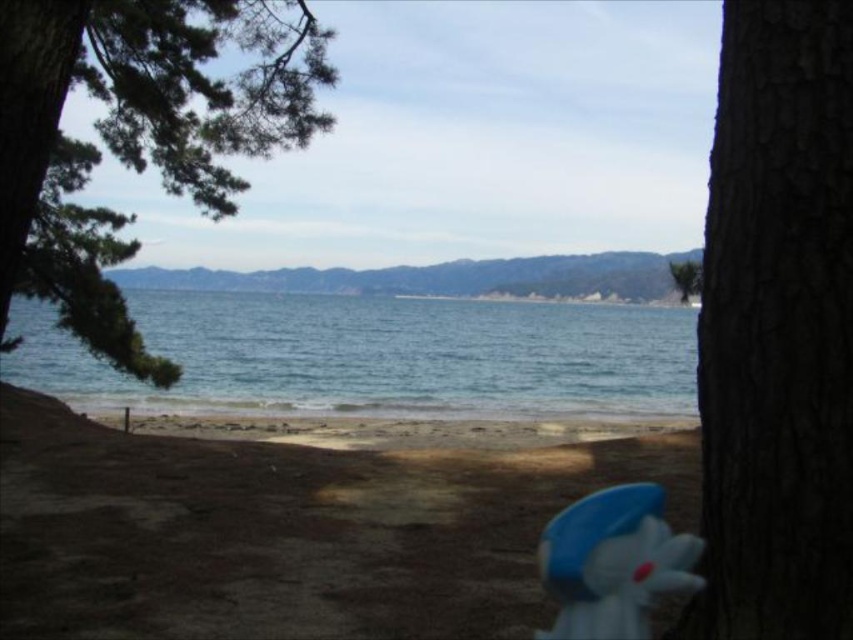
Is sandy brown beach at center positioned before blue water at center?

Yes, it is.

Is point (251, 593) more distant than point (277, 346)?

No, it is not.

Is point (78, 612) positioned behind point (132, 298)?

No, (78, 612) is in front of (132, 298).

In order to click on sandy brown beach at center in this screenshot , I will do `click(286, 531)`.

Is point (711, 397) positioned in front of point (662, 566)?

Yes.

Where is `brown rough bark tree at right`? This screenshot has width=853, height=640. brown rough bark tree at right is located at coordinates (776, 330).

At what (x,y) coordinates should I click in order to perform the action: click on brown rough bark tree at right. Please return your answer as a coordinate pair (x, y). Image resolution: width=853 pixels, height=640 pixels. Looking at the image, I should click on (776, 330).

Consider the image. Between sandy brown beach at center and blue rubber duck at lower right, which one has more height?

Standing taller between the two is blue rubber duck at lower right.

Between point (192, 634) and point (573, 576), which one is positioned in front?

Positioned in front is point (573, 576).

Find the location of a particular element. sandy brown beach at center is located at coordinates (286, 531).